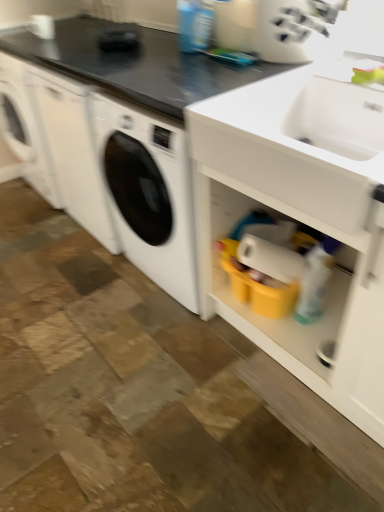
Question: Does black matte countertop at upper center have a greater width compared to white matte cabinet at lower right?

Choices:
 (A) yes
 (B) no

Answer: (B)

Question: Is black matte countertop at upper center turned away from white matte cabinet at lower right?

Choices:
 (A) no
 (B) yes

Answer: (A)

Question: Does black matte countertop at upper center appear on the left side of white matte cabinet at lower right?

Choices:
 (A) no
 (B) yes

Answer: (B)

Question: Can you confirm if black matte countertop at upper center is shorter than white matte cabinet at lower right?

Choices:
 (A) no
 (B) yes

Answer: (B)

Question: From a real-world perspective, is black matte countertop at upper center over white matte cabinet at lower right?

Choices:
 (A) no
 (B) yes

Answer: (B)

Question: Is black matte countertop at upper center oriented towards white matte cabinet at lower right?

Choices:
 (A) no
 (B) yes

Answer: (A)

Question: Is white plastic knife block at upper center surrounded by white matte cabinet at lower right?

Choices:
 (A) yes
 (B) no

Answer: (B)

Question: Considering the relative sizes of white matte cabinet at lower right and white plastic knife block at upper center in the image provided, is white matte cabinet at lower right smaller than white plastic knife block at upper center?

Choices:
 (A) yes
 (B) no

Answer: (B)

Question: From a real-world perspective, does white matte cabinet at lower right stand above white plastic knife block at upper center?

Choices:
 (A) no
 (B) yes

Answer: (A)

Question: Does white matte cabinet at lower right appear on the right side of white plastic knife block at upper center?

Choices:
 (A) no
 (B) yes

Answer: (B)

Question: Is white matte cabinet at lower right turned away from white plastic knife block at upper center?

Choices:
 (A) no
 (B) yes

Answer: (A)

Question: Is white matte cabinet at lower right not near white plastic knife block at upper center?

Choices:
 (A) yes
 (B) no

Answer: (B)

Question: Is white matte cabinet at lower right wider than black matte countertop at upper center?

Choices:
 (A) no
 (B) yes

Answer: (B)